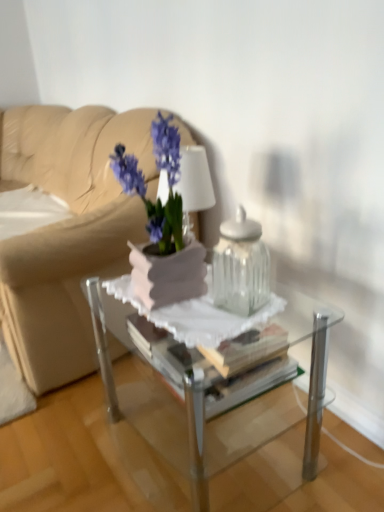
Question: Is clear glass jar at center taller than beige leather couch at upper left?

Choices:
 (A) no
 (B) yes

Answer: (A)

Question: Is beige leather couch at upper left at the back of clear glass jar at center?

Choices:
 (A) yes
 (B) no

Answer: (B)

Question: Is clear glass jar at center behind beige leather couch at upper left?

Choices:
 (A) no
 (B) yes

Answer: (A)

Question: Is clear glass jar at center facing towards beige leather couch at upper left?

Choices:
 (A) yes
 (B) no

Answer: (B)

Question: Considering the relative positions of clear glass jar at center and beige leather couch at upper left in the image provided, is clear glass jar at center in front of beige leather couch at upper left?

Choices:
 (A) no
 (B) yes

Answer: (B)

Question: Is clear glass jar at center at the right side of beige leather couch at upper left?

Choices:
 (A) yes
 (B) no

Answer: (A)

Question: Considering the relative sizes of clear glass jar at center and matte white vase at center in the image provided, is clear glass jar at center wider than matte white vase at center?

Choices:
 (A) yes
 (B) no

Answer: (B)

Question: Can you confirm if clear glass jar at center is taller than matte white vase at center?

Choices:
 (A) no
 (B) yes

Answer: (A)

Question: From a real-world perspective, is clear glass jar at center physically above matte white vase at center?

Choices:
 (A) yes
 (B) no

Answer: (B)

Question: Is clear glass jar at center oriented towards matte white vase at center?

Choices:
 (A) yes
 (B) no

Answer: (B)

Question: Is the depth of clear glass jar at center less than that of matte white vase at center?

Choices:
 (A) yes
 (B) no

Answer: (B)

Question: Would you say clear glass jar at center is outside matte white vase at center?

Choices:
 (A) yes
 (B) no

Answer: (A)

Question: Is matte white vase at center smaller than clear glass jar at center?

Choices:
 (A) no
 (B) yes

Answer: (A)